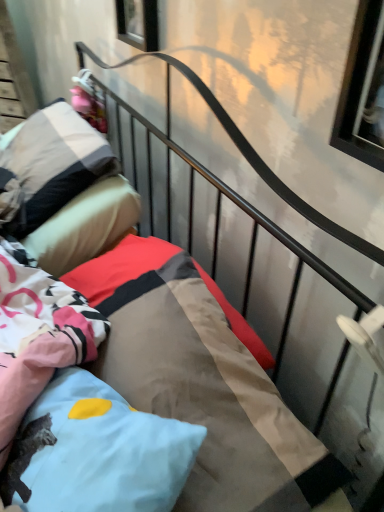
The image size is (384, 512). In order to click on textured cotton mattress at center in this screenshot , I will do `click(203, 380)`.

Describe the element at coordinates (88, 101) in the screenshot. I see `pink fabric doll at upper left` at that location.

What are the coordinates of `transparent glass window at upper center, which is the 1th window from top to bottom` in the screenshot? It's located at (138, 23).

What are the coordinates of `clear glass window at upper right, the first window from the right` in the screenshot? It's located at (363, 90).

This screenshot has height=512, width=384. Find the location of `mattress on the right of transparent glass window at upper center, which is the 1th window from top to bottom`. mattress on the right of transparent glass window at upper center, which is the 1th window from top to bottom is located at coordinates (203, 380).

Is textured cotton mattress at center surrounded by transparent glass window at upper center, the 2th window from the bottom?

No, textured cotton mattress at center is not inside transparent glass window at upper center, the 2th window from the bottom.

Is transparent glass window at upper center, the first window viewed from the back, directly adjacent to textured cotton mattress at center?

There is a gap between transparent glass window at upper center, the first window viewed from the back, and textured cotton mattress at center.

Can you confirm if transparent glass window at upper center, the 2th window from the bottom, is positioned to the left of textured cotton mattress at center?

Correct, you'll find transparent glass window at upper center, the 2th window from the bottom, to the left of textured cotton mattress at center.

Starting from the transparent glass window at upper center, marked as the first window in a left-to-right arrangement, which pillow is the 1st one in front? Please provide its 2D coordinates.

[(55, 162)]

From the image's perspective, which is below, transparent glass window at upper center, marked as the first window in a left-to-right arrangement, or soft cotton pillow at upper left, marked as the second pillow in a bottom-to-top arrangement?

soft cotton pillow at upper left, marked as the second pillow in a bottom-to-top arrangement, appears lower in the image.

Is transparent glass window at upper center, which is the 1th window from top to bottom, placed right next to soft cotton pillow at upper left, which appears as the 1th pillow when viewed from the back?

transparent glass window at upper center, which is the 1th window from top to bottom, and soft cotton pillow at upper left, which appears as the 1th pillow when viewed from the back, are clearly separated.

Is clear glass window at upper right, which is the 2th window in back-to-front order, positioned before transparent glass window at upper center, arranged as the 2th window when viewed from the right?

Yes, clear glass window at upper right, which is the 2th window in back-to-front order, is closer to the viewer.

Which object is positioned more to the right, clear glass window at upper right, acting as the first window starting from the bottom, or transparent glass window at upper center, which is the 1th window from top to bottom?

clear glass window at upper right, acting as the first window starting from the bottom, is more to the right.

Would you say clear glass window at upper right, acting as the 2th window starting from the left, contains transparent glass window at upper center, the 2th window from the bottom?

No, transparent glass window at upper center, the 2th window from the bottom, is not a part of clear glass window at upper right, acting as the 2th window starting from the left.

Considering the relative sizes of clear glass window at upper right, which ranks as the 1th window in front-to-back order, and transparent glass window at upper center, the first window viewed from the back, in the image provided, is clear glass window at upper right, which ranks as the 1th window in front-to-back order, wider than transparent glass window at upper center, the first window viewed from the back,?

No.

From a real-world perspective, is soft cotton pillow at upper left, which appears as the 1th pillow when viewed from the back, above or below textured cotton mattress at center?

Clearly, from a real-world perspective, soft cotton pillow at upper left, which appears as the 1th pillow when viewed from the back, is above textured cotton mattress at center.

Considering the relative positions of soft cotton pillow at upper left, marked as the second pillow in a bottom-to-top arrangement, and textured cotton mattress at center in the image provided, is soft cotton pillow at upper left, marked as the second pillow in a bottom-to-top arrangement, in front of textured cotton mattress at center?

No, the depth of soft cotton pillow at upper left, marked as the second pillow in a bottom-to-top arrangement, is greater than that of textured cotton mattress at center.

Consider the image. Is soft cotton pillow at upper left, which appears as the 1th pillow when viewed from the back, next to textured cotton mattress at center and touching it?

No, soft cotton pillow at upper left, which appears as the 1th pillow when viewed from the back, is not next to textured cotton mattress at center.

Which of these two, soft cotton pillow at upper left, which appears as the 1th pillow when viewed from the back, or textured cotton mattress at center, stands shorter?

textured cotton mattress at center.

Does transparent glass window at upper center, arranged as the 2th window when viewed from the right, come behind pink fabric doll at upper left?

No, it is in front of pink fabric doll at upper left.

Consider the image. Does transparent glass window at upper center, the 2th window from the bottom, touch pink fabric doll at upper left?

They are not placed beside each other.

Considering the sizes of objects transparent glass window at upper center, the first window viewed from the back, and pink fabric doll at upper left in the image provided, who is bigger, transparent glass window at upper center, the first window viewed from the back, or pink fabric doll at upper left?

With larger size is pink fabric doll at upper left.

Would you consider pink fabric doll at upper left to be distant from transparent glass window at upper center, the 2th window from the bottom?

That's not correct — pink fabric doll at upper left is a little close to transparent glass window at upper center, the 2th window from the bottom.

From the picture: Considering the sizes of objects pink fabric doll at upper left and transparent glass window at upper center, which is the second window from front to back, in the image provided, who is bigger, pink fabric doll at upper left or transparent glass window at upper center, which is the second window from front to back,?

pink fabric doll at upper left is bigger.

Considering the positions of objects pink fabric doll at upper left and transparent glass window at upper center, which is the second window from front to back, in the image provided, who is behind, pink fabric doll at upper left or transparent glass window at upper center, which is the second window from front to back,?

pink fabric doll at upper left.

How many degrees apart are the facing directions of light blue fabric pillow at center, the first pillow viewed from the front, and transparent glass window at upper center, the first window viewed from the back?

There is a 32-degree angle between the facing directions of light blue fabric pillow at center, the first pillow viewed from the front, and transparent glass window at upper center, the first window viewed from the back.

Is light blue fabric pillow at center, the first pillow ordered from the bottom, further to camera compared to transparent glass window at upper center, arranged as the 2th window when viewed from the right?

That is False.

How much distance is there between light blue fabric pillow at center, the first pillow ordered from the bottom, and transparent glass window at upper center, the 2th window from the bottom?

light blue fabric pillow at center, the first pillow ordered from the bottom, is 1.12 meters away from transparent glass window at upper center, the 2th window from the bottom.

Can you confirm if light blue fabric pillow at center, the first pillow viewed from the front, is taller than transparent glass window at upper center, the 2th window from the bottom?

Correct, light blue fabric pillow at center, the first pillow viewed from the front, is much taller as transparent glass window at upper center, the 2th window from the bottom.

You are a GUI agent. You are given a task and a screenshot of the screen. Output one action in this format:
    pyautogui.click(x=<x>, y=<y>)
    Task: Click on the window that is the 2nd object located above the textured cotton mattress at center (from the image's perspective)
    This screenshot has width=384, height=512.
    Given the screenshot: What is the action you would take?
    (x=138, y=23)

This screenshot has width=384, height=512. In order to click on the 1st pillow positioned below the transparent glass window at upper center, which is the 1th window from top to bottom (from a real-world perspective) in this screenshot , I will do (x=55, y=162).

From the image, which object appears to be farther from soft cotton pillow at upper left, which appears as the 1th pillow when viewed from the back, light blue fabric pillow at center, which is the 2th pillow from back to front, or pink fabric doll at upper left?

light blue fabric pillow at center, which is the 2th pillow from back to front.

Considering their positions, is textured cotton mattress at center positioned further to clear glass window at upper right, acting as the 2th window starting from the left, than light blue fabric pillow at center, which appears as the 2th pillow when viewed from the top?

light blue fabric pillow at center, which appears as the 2th pillow when viewed from the top, is positioned further to the anchor clear glass window at upper right, acting as the 2th window starting from the left.

Considering their positions, is soft cotton pillow at upper left, which is the 1th pillow in top-to-bottom order, positioned further to textured cotton mattress at center than transparent glass window at upper center, the 2th window from the bottom?

transparent glass window at upper center, the 2th window from the bottom, is further to textured cotton mattress at center.

Consider the image. Estimate the real-world distances between objects in this image. Which object is closer to transparent glass window at upper center, the 2th window from the bottom, soft cotton pillow at upper left, which is the 1th pillow in top-to-bottom order, or pink fabric doll at upper left?

Among the two, soft cotton pillow at upper left, which is the 1th pillow in top-to-bottom order, is located nearer to transparent glass window at upper center, the 2th window from the bottom.

When comparing their distances from textured cotton mattress at center, does light blue fabric pillow at center, which appears as the 2th pillow when viewed from the top, or transparent glass window at upper center, the 2th window from the bottom, seem closer?

The object closer to textured cotton mattress at center is light blue fabric pillow at center, which appears as the 2th pillow when viewed from the top.

From the image, which object appears to be nearer to textured cotton mattress at center, soft cotton pillow at upper left, marked as the second pillow in a bottom-to-top arrangement, or clear glass window at upper right, acting as the 2th window starting from the left?

clear glass window at upper right, acting as the 2th window starting from the left, is positioned closer to the anchor textured cotton mattress at center.

When comparing their distances from pink fabric doll at upper left, does textured cotton mattress at center or soft cotton pillow at upper left, which appears as the 1th pillow when viewed from the back, seem further?

textured cotton mattress at center is positioned further to the anchor pink fabric doll at upper left.

Looking at the image, which one is located further to transparent glass window at upper center, arranged as the 2th window when viewed from the right, soft cotton pillow at upper left, which appears as the 1th pillow when viewed from the back, or clear glass window at upper right, which is the 2th window from top to bottom?

clear glass window at upper right, which is the 2th window from top to bottom, is further to transparent glass window at upper center, arranged as the 2th window when viewed from the right.

The image size is (384, 512). What are the coordinates of `mattress between clear glass window at upper right, which ranks as the 1th window in front-to-back order, and pink fabric doll at upper left in the front-back direction` in the screenshot? It's located at [203, 380].

Where is `mattress that lies between transparent glass window at upper center, marked as the first window in a left-to-right arrangement, and light blue fabric pillow at center, which is the 2th pillow from back to front, from top to bottom`? This screenshot has width=384, height=512. mattress that lies between transparent glass window at upper center, marked as the first window in a left-to-right arrangement, and light blue fabric pillow at center, which is the 2th pillow from back to front, from top to bottom is located at coordinates (203, 380).

You are a GUI agent. You are given a task and a screenshot of the screen. Output one action in this format:
    pyautogui.click(x=<x>, y=<y>)
    Task: Click on the window between transparent glass window at upper center, which is the 1th window from top to bottom, and light blue fabric pillow at center, which appears as the 2th pillow when viewed from the top, in the up-down direction
    
    Given the screenshot: What is the action you would take?
    pyautogui.click(x=363, y=90)

Locate an element on the screen. This screenshot has width=384, height=512. window between transparent glass window at upper center, the first window viewed from the back, and textured cotton mattress at center vertically is located at coordinates (363, 90).